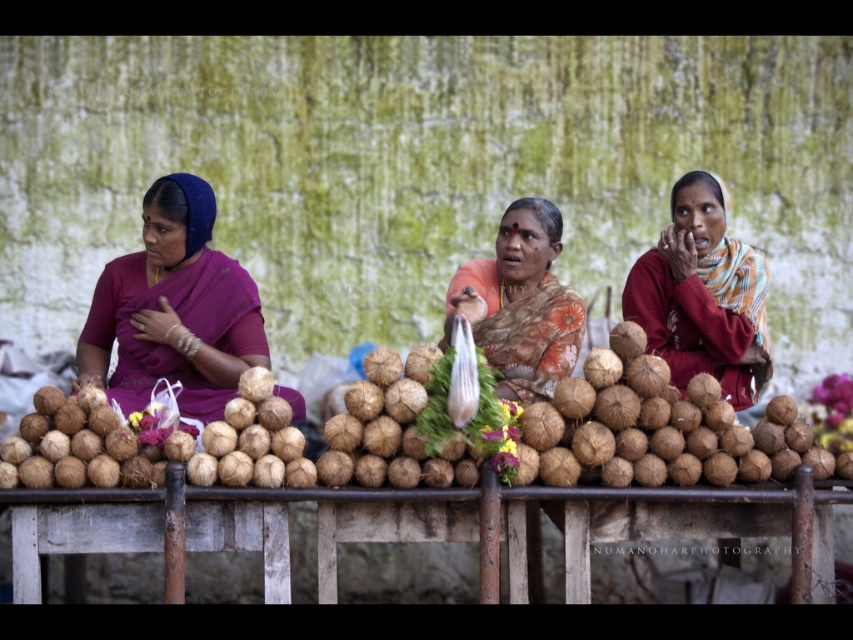
Question: Does matte brown coconut at center appear on the left side of matte orange sari at center?

Choices:
 (A) no
 (B) yes

Answer: (A)

Question: Among these objects, which one is nearest to the camera?

Choices:
 (A) matte brown coconut at center
 (B) purple silk saree at left
 (C) brown rough coconut at center

Answer: (C)

Question: Which of these objects is positioned closest to the matte brown coconut at center?

Choices:
 (A) purple silk saree at left
 (B) matte orange sari at center
 (C) brown rough coconut at center

Answer: (B)

Question: Which point is closer to the camera?

Choices:
 (A) matte brown coconut at center
 (B) matte orange sari at center
 (C) brown rough coconut at center

Answer: (C)

Question: Does purple silk saree at left lie in front of matte orange sari at center?

Choices:
 (A) no
 (B) yes

Answer: (B)

Question: Does purple silk saree at left have a lesser width compared to matte orange sari at center?

Choices:
 (A) yes
 (B) no

Answer: (B)